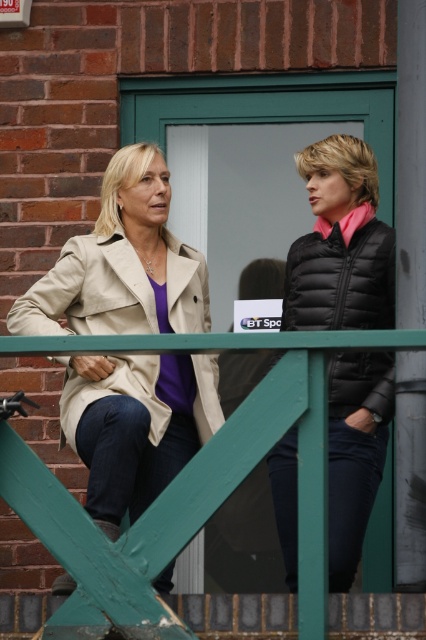
Is black puffer jacket at upper right positioned behind black quilted vest at right?

No, black puffer jacket at upper right is closer to the viewer.

Does black puffer jacket at upper right have a larger size compared to black quilted vest at right?

Yes.

Is point (367, 157) in front of point (327, 257)?

Yes, it is.

Find the location of a particular element. The image size is (426, 640). black puffer jacket at upper right is located at coordinates (340, 244).

Does point (348, 500) come in front of point (71, 390)?

Yes.

The height and width of the screenshot is (640, 426). Describe the element at coordinates (340, 244) in the screenshot. I see `black puffer jacket at upper right` at that location.

Find the location of a particular element. black puffer jacket at upper right is located at coordinates (340, 244).

Where is `beige fabric coat at left`? This screenshot has width=426, height=640. beige fabric coat at left is located at coordinates [89, 292].

Between beige fabric coat at left and black quilted vest at right, which one appears on the right side from the viewer's perspective?

black quilted vest at right

Where is `beige fabric coat at left`? The width and height of the screenshot is (426, 640). beige fabric coat at left is located at coordinates (89, 292).